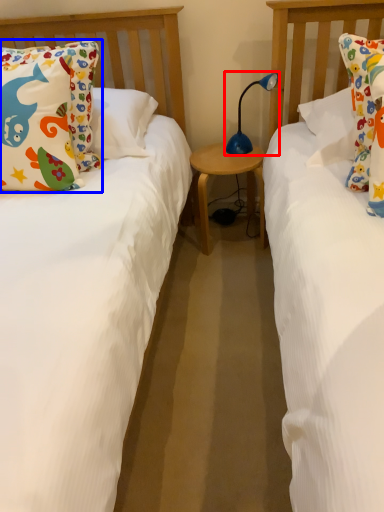
Question: Among these objects, which one is nearest to the camera, table lamp (highlighted by a red box) or pillow (highlighted by a blue box)?

Choices:
 (A) table lamp
 (B) pillow

Answer: (B)